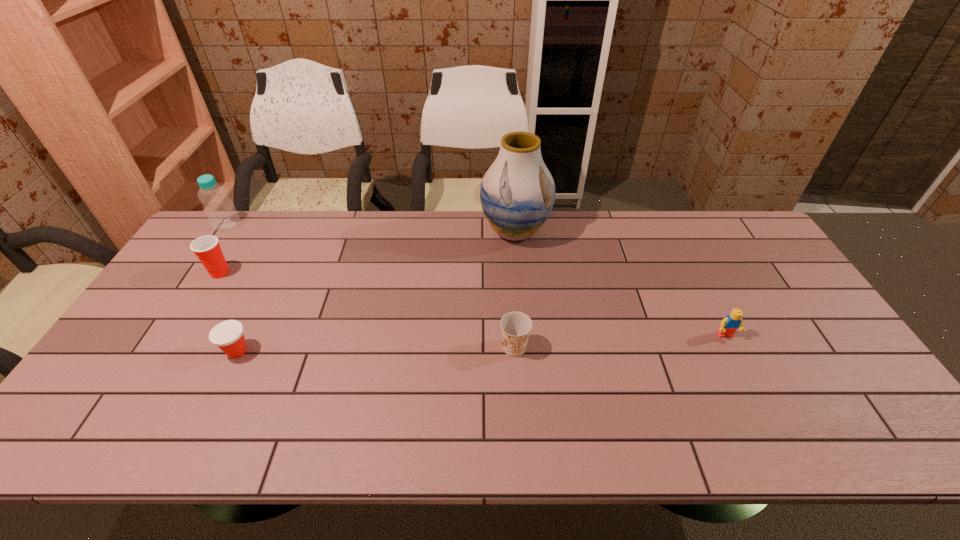
Where is `vacant space at the near edge of the desktop`? vacant space at the near edge of the desktop is located at coordinates (655, 413).

You are a GUI agent. You are given a task and a screenshot of the screen. Output one action in this format:
    pyautogui.click(x=<x>, y=<y>)
    Task: Click on the vacant region at the left edge of the desktop
    This screenshot has height=540, width=960.
    Given the screenshot: What is the action you would take?
    pyautogui.click(x=144, y=363)

The image size is (960, 540). In the image, there is a desktop. Identify the location of free space at the right edge. (x=827, y=335).

Identify the location of empty location between the farthest Dixie cup and the shortest Dixie cup. The image size is (960, 540). (228, 312).

Locate an element on the screen. This screenshot has width=960, height=540. free space between the tallest object and the bottle is located at coordinates (372, 228).

Locate an element on the screen. This screenshot has width=960, height=540. vacant area between the rightmost object and the shortest object is located at coordinates (481, 343).

I want to click on vacant space that's between the shortest Dixie cup and the rightmost Dixie cup, so click(x=376, y=349).

Find the location of a particular element. free spot between the second Dixie cup from right to left and the second tallest object is located at coordinates (232, 288).

Find the location of a particular element. This screenshot has width=960, height=540. free space between the fifth shortest object and the fourth nearest object is located at coordinates (224, 249).

The image size is (960, 540). I want to click on unoccupied position between the tallest object and the second tallest object, so click(372, 228).